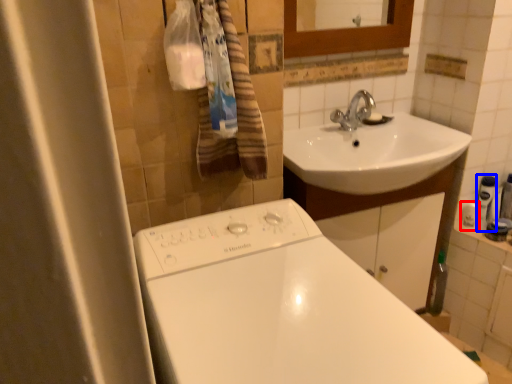
Question: Among these objects, which one is farthest to the camera, toiletry (highlighted by a red box) or toiletry (highlighted by a blue box)?

Choices:
 (A) toiletry
 (B) toiletry

Answer: (A)